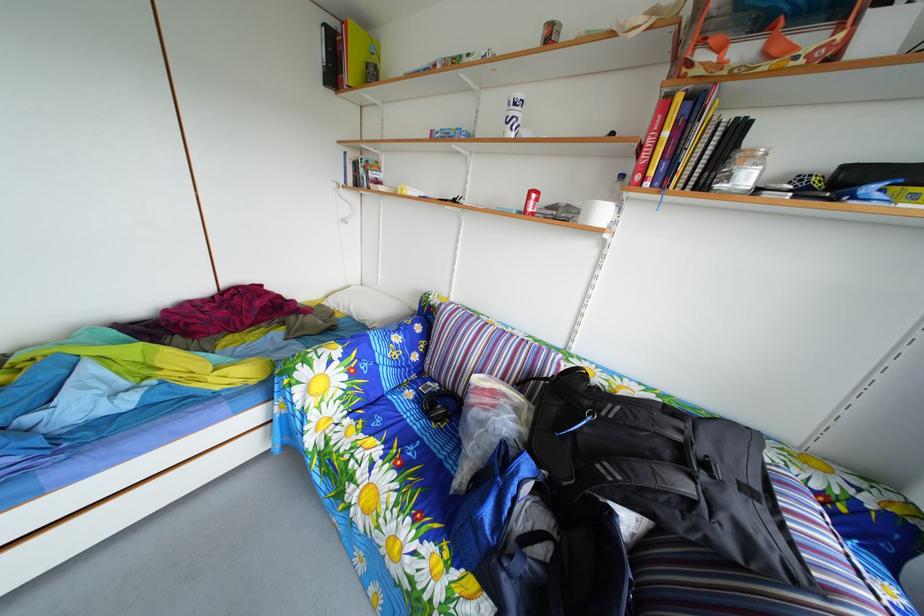
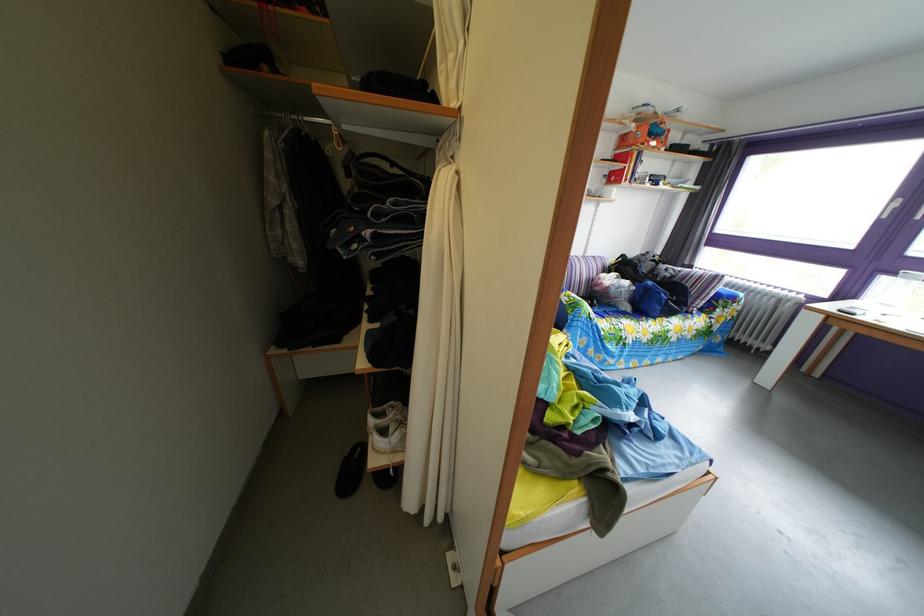
Find the pixel in the second image that matches (772,33) in the first image.

(661, 144)